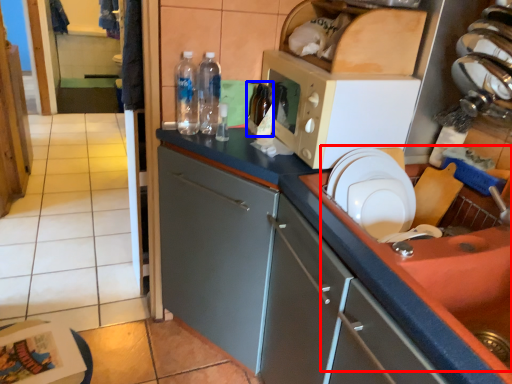
Question: Which object is further to the camera taking this photo, sink (highlighted by a red box) or bottle (highlighted by a blue box)?

Choices:
 (A) sink
 (B) bottle

Answer: (B)